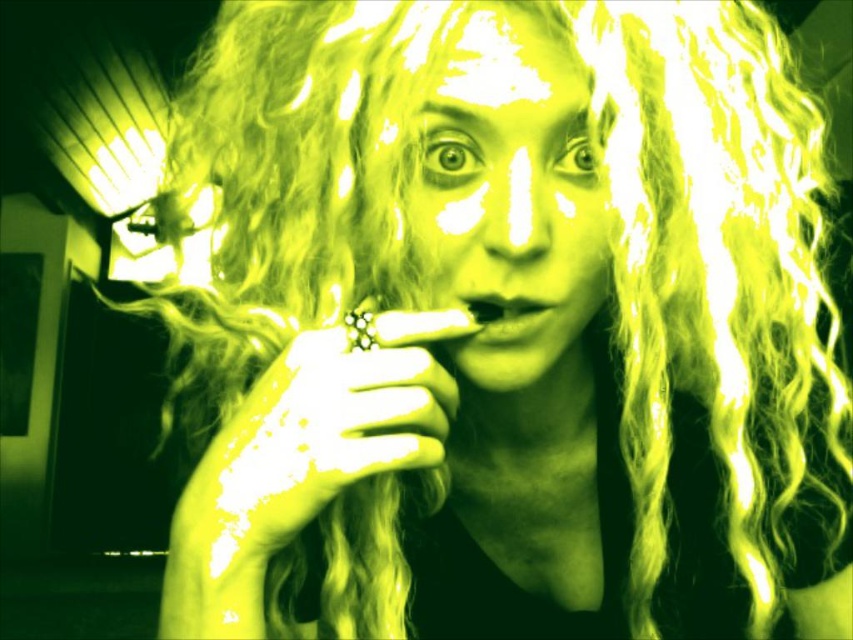
You are an artist analyzing the lighting in the image. You notice the matte yellow face at center and the smooth matte mouth at center. Which object is more affected by the dramatic contrast between light and shadow?

The matte yellow face at center is closer to the viewer than the smooth matte mouth at center, so it is more affected by the dramatic contrast between light and shadow.

Based on the scene description, what object is located at the coordinates point (511,198)?

The point (511,198) corresponds to the matte yellow face at center.

Based on the scene description, where is the matte yellow face at center located relative to the smooth matte mouth at center?

The matte yellow face at center is to the right of the smooth matte mouth at center.